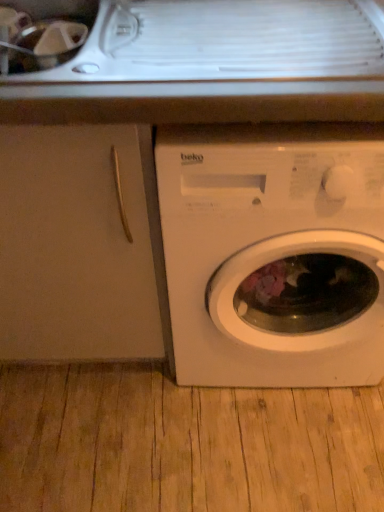
Locate an element on the screen. The height and width of the screenshot is (512, 384). white matte washing machine at lower right is located at coordinates (274, 253).

Measure the distance between white matte washing machine at lower right and camera.

66.08 centimeters.

Describe the element at coordinates (274, 253) in the screenshot. The image size is (384, 512). I see `white matte washing machine at lower right` at that location.

Where is `matte white cabinet at left`? Image resolution: width=384 pixels, height=512 pixels. matte white cabinet at left is located at coordinates tap(79, 245).

Image resolution: width=384 pixels, height=512 pixels. Describe the element at coordinates (79, 245) in the screenshot. I see `matte white cabinet at left` at that location.

Where is `white matte washing machine at lower right`? Image resolution: width=384 pixels, height=512 pixels. white matte washing machine at lower right is located at coordinates (274, 253).

Between white matte washing machine at lower right and matte white cabinet at left, which one appears on the right side from the viewer's perspective?

From the viewer's perspective, white matte washing machine at lower right appears more on the right side.

Is the position of white matte washing machine at lower right less distant than that of matte white cabinet at left?

Yes, it is in front of matte white cabinet at left.

Considering the points (378, 149) and (107, 344), which point is behind, point (378, 149) or point (107, 344)?

The point (107, 344) is behind.

From the image's perspective, is white matte washing machine at lower right over matte white cabinet at left?

Incorrect, from the image's perspective, white matte washing machine at lower right is lower than matte white cabinet at left.

From a real-world perspective, is white matte washing machine at lower right over matte white cabinet at left?

No, from a real-world perspective, white matte washing machine at lower right is not above matte white cabinet at left.

Looking at this image, can you confirm if white matte washing machine at lower right is wider than matte white cabinet at left?

Correct, the width of white matte washing machine at lower right exceeds that of matte white cabinet at left.

Who is shorter, white matte washing machine at lower right or matte white cabinet at left?

matte white cabinet at left is shorter.

Is white matte washing machine at lower right smaller than matte white cabinet at left?

Yes.

Is white matte washing machine at lower right positioned beyond the bounds of matte white cabinet at left?

Yes.

Is white matte washing machine at lower right with matte white cabinet at left?

white matte washing machine at lower right is not next to matte white cabinet at left, and they're not touching.

Could you tell me if white matte washing machine at lower right is turned towards matte white cabinet at left?

No, white matte washing machine at lower right is not aimed at matte white cabinet at left.

At what (x,y) coordinates should I click in order to perform the action: click on screen door positioned vertically above the white matte washing machine at lower right (from a real-world perspective). Please return your answer as a coordinate pair (x, y). Looking at the image, I should click on (79, 245).

Between matte white cabinet at left and white matte washing machine at lower right, which one appears on the right side from the viewer's perspective?

white matte washing machine at lower right is more to the right.

Is the depth of matte white cabinet at left less than that of white matte washing machine at lower right?

No, it is not.

Which is in front, point (90, 126) or point (185, 188)?

Point (90, 126)

From the image's perspective, who appears lower, matte white cabinet at left or white matte washing machine at lower right?

white matte washing machine at lower right is shown below in the image.

From a real-world perspective, is matte white cabinet at left below white matte washing machine at lower right?

Incorrect, from a real-world perspective, matte white cabinet at left is higher than white matte washing machine at lower right.

Considering the sizes of objects matte white cabinet at left and white matte washing machine at lower right in the image provided, who is wider, matte white cabinet at left or white matte washing machine at lower right?

With larger width is white matte washing machine at lower right.

Considering the sizes of objects matte white cabinet at left and white matte washing machine at lower right in the image provided, who is taller, matte white cabinet at left or white matte washing machine at lower right?

With more height is white matte washing machine at lower right.

Considering the sizes of objects matte white cabinet at left and white matte washing machine at lower right in the image provided, who is smaller, matte white cabinet at left or white matte washing machine at lower right?

white matte washing machine at lower right is smaller.

Based on the photo, is matte white cabinet at left positioned beyond the bounds of white matte washing machine at lower right?

That's correct, matte white cabinet at left is outside of white matte washing machine at lower right.

Is matte white cabinet at left far away from white matte washing machine at lower right?

No, matte white cabinet at left is not far away from white matte washing machine at lower right.

Is matte white cabinet at left facing away from white matte washing machine at lower right?

No, matte white cabinet at left's orientation is not away from white matte washing machine at lower right.

Locate an element on the screen. screen door on the left of white matte washing machine at lower right is located at coordinates (79, 245).

This screenshot has width=384, height=512. Identify the location of washing machine that is below the matte white cabinet at left (from the image's perspective). (274, 253).

Locate an element on the screen. The image size is (384, 512). washing machine that appears on the right of matte white cabinet at left is located at coordinates (274, 253).